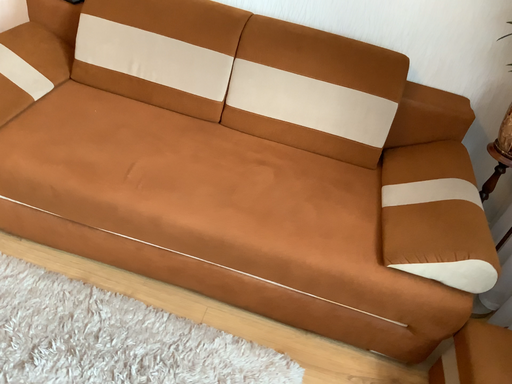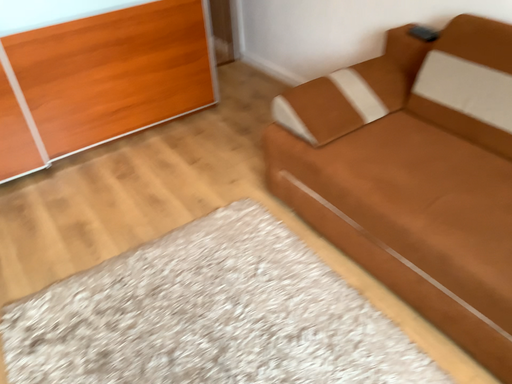
Question: How did the camera likely rotate when shooting the video?

Choices:
 (A) rotated upward
 (B) rotated downward

Answer: (A)